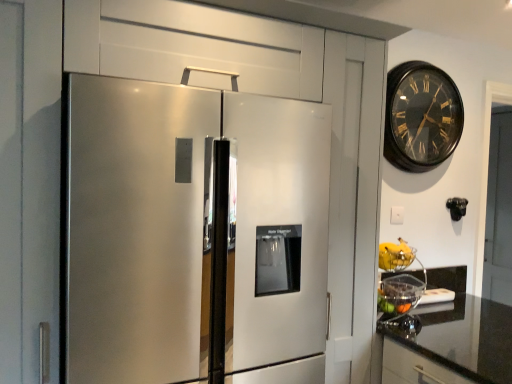
Measure the distance between point (470, 358) and camera.

The distance of point (470, 358) from camera is 5.68 feet.

Locate an element on the screen. black wooden clock at upper right is located at coordinates (421, 116).

At what (x,y) coordinates should I click in order to perform the action: click on black granite countertop at lower right. Please return your answer as a coordinate pair (x, y). Looking at the image, I should click on (450, 345).

In terms of height, does black granite countertop at lower right look taller or shorter compared to black wooden clock at upper right?

Considering their sizes, black granite countertop at lower right has more height than black wooden clock at upper right.

Is black granite countertop at lower right thinner than black wooden clock at upper right?

No, black granite countertop at lower right is not thinner than black wooden clock at upper right.

Who is smaller, black granite countertop at lower right or black wooden clock at upper right?

black wooden clock at upper right is smaller.

Where is `wall clock on the left of black granite countertop at lower right`? The width and height of the screenshot is (512, 384). wall clock on the left of black granite countertop at lower right is located at coordinates (421, 116).

Would you say yellow matte bananas at right is inside or outside black wooden clock at upper right?

yellow matte bananas at right exists outside the volume of black wooden clock at upper right.

Is black wooden clock at upper right at the back of yellow matte bananas at right?

No.

Based on their sizes in the image, would you say yellow matte bananas at right is bigger or smaller than black wooden clock at upper right?

yellow matte bananas at right is smaller than black wooden clock at upper right.

You are a GUI agent. You are given a task and a screenshot of the screen. Output one action in this format:
    pyautogui.click(x=<x>, y=<y>)
    Task: Click on the fruit that is on the left side of black wooden clock at upper right
    
    Given the screenshot: What is the action you would take?
    pyautogui.click(x=395, y=255)

In terms of width, does yellow matte bananas at right look wider or thinner when compared to black granite countertop at lower right?

yellow matte bananas at right is thinner than black granite countertop at lower right.

Between yellow matte bananas at right and black granite countertop at lower right, which one is positioned in front?

black granite countertop at lower right is more forward.

Is point (402, 244) less distant than point (483, 320)?

No, it is behind (483, 320).

Between yellow matte bananas at right and black granite countertop at lower right, which one has smaller size?

yellow matte bananas at right is smaller.

Between black wooden clock at upper right and yellow matte bananas at right, which one has larger size?

Bigger between the two is black wooden clock at upper right.

Would you say black wooden clock at upper right is inside or outside yellow matte bananas at right?

black wooden clock at upper right is not enclosed by yellow matte bananas at right.

From the image's perspective, is black wooden clock at upper right above or below yellow matte bananas at right?

Clearly, from the image's perspective, black wooden clock at upper right is above yellow matte bananas at right.

Would you say black granite countertop at lower right is to the left or to the right of yellow matte bananas at right in the picture?

In the image, black granite countertop at lower right appears on the right side of yellow matte bananas at right.

From a real-world perspective, is black granite countertop at lower right on top of yellow matte bananas at right?

No, from a real-world perspective, black granite countertop at lower right is not above yellow matte bananas at right.

From the image's perspective, would you say black granite countertop at lower right is shown under yellow matte bananas at right?

Yes.

Which point is more distant from viewer, (x=197, y=115) or (x=434, y=373)?

Positioned behind is point (x=434, y=373).

Based on the photo, based on their positions, is stainless steel refrigerator at left located to the left or right of black granite countertop at lower right?

stainless steel refrigerator at left is to the left of black granite countertop at lower right.

From a real-world perspective, which is physically below, stainless steel refrigerator at left or black granite countertop at lower right?

In real-world perspective, black granite countertop at lower right is lower.

Does point (391, 254) come farther from viewer compared to point (295, 363)?

Yes, point (391, 254) is behind point (295, 363).

Is stainless steel refrigerator at left at the back of yellow matte bananas at right?

yellow matte bananas at right does not have its back to stainless steel refrigerator at left.

Is yellow matte bananas at right inside the boundaries of stainless steel refrigerator at left, or outside?

The correct answer is: outside.

Looking at their sizes, would you say yellow matte bananas at right is wider or thinner than stainless steel refrigerator at left?

Considering their sizes, yellow matte bananas at right looks slimmer than stainless steel refrigerator at left.

What are the coordinates of `countertop in front of the black wooden clock at upper right` in the screenshot? It's located at (450, 345).

This screenshot has width=512, height=384. Find the location of `wall clock that appears above the yellow matte bananas at right (from the image's perspective)`. wall clock that appears above the yellow matte bananas at right (from the image's perspective) is located at coordinates (421, 116).

Looking at the image, which one is located further to black wooden clock at upper right, black granite countertop at lower right or yellow matte bananas at right?

black granite countertop at lower right is positioned further to the anchor black wooden clock at upper right.

Considering their positions, is stainless steel refrigerator at left positioned closer to black granite countertop at lower right than yellow matte bananas at right?

Among the two, yellow matte bananas at right is located nearer to black granite countertop at lower right.

Based on their spatial positions, is black wooden clock at upper right or stainless steel refrigerator at left further from black granite countertop at lower right?

black wooden clock at upper right lies further to black granite countertop at lower right than the other object.

Looking at the image, which one is located closer to yellow matte bananas at right, black granite countertop at lower right or black wooden clock at upper right?

black granite countertop at lower right is closer to yellow matte bananas at right.

Looking at the image, which one is located further to stainless steel refrigerator at left, black granite countertop at lower right or yellow matte bananas at right?

yellow matte bananas at right.

Considering their positions, is black granite countertop at lower right positioned further to stainless steel refrigerator at left than black wooden clock at upper right?

Based on the image, black wooden clock at upper right appears to be further to stainless steel refrigerator at left.

Based on their spatial positions, is yellow matte bananas at right or black wooden clock at upper right closer to black granite countertop at lower right?

yellow matte bananas at right lies closer to black granite countertop at lower right than the other object.

Considering their positions, is black granite countertop at lower right positioned further to black wooden clock at upper right than stainless steel refrigerator at left?

black granite countertop at lower right is further to black wooden clock at upper right.

What are the coordinates of `fruit located between stainless steel refrigerator at left and black wooden clock at upper right in the left-right direction` in the screenshot? It's located at (395, 255).

The width and height of the screenshot is (512, 384). I want to click on fruit between black wooden clock at upper right and black granite countertop at lower right in the up-down direction, so click(x=395, y=255).

Identify the location of wall clock situated between stainless steel refrigerator at left and black granite countertop at lower right from left to right. The image size is (512, 384). (421, 116).

I want to click on fruit between stainless steel refrigerator at left and black granite countertop at lower right, so 395,255.